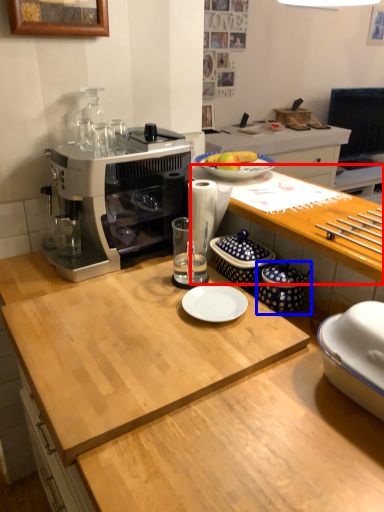
Question: Which object appears closest to the camera in this image, desk (highlighted by a red box) or appliance (highlighted by a blue box)?

Choices:
 (A) desk
 (B) appliance

Answer: (A)